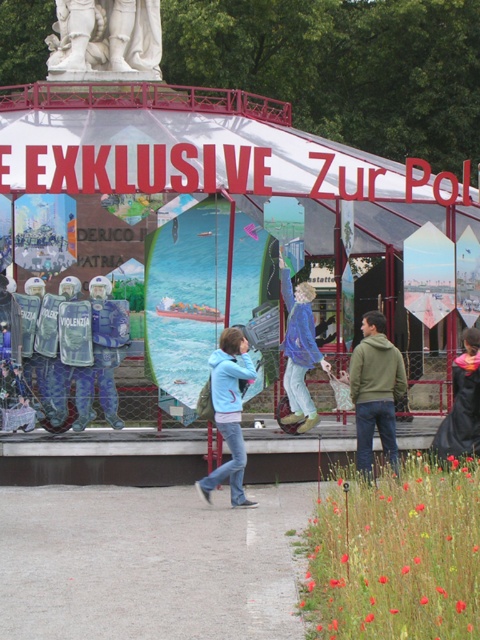
Who is higher up, light blue hoodie at center or blue denim jacket at center?

Positioned higher is blue denim jacket at center.

Who is lower down, light blue hoodie at center or blue denim jacket at center?

light blue hoodie at center

Locate an element on the screen. light blue hoodie at center is located at coordinates (228, 412).

Is blue reflective vest at center below black fabric coat at right?

No, blue reflective vest at center is not below black fabric coat at right.

At what (x,y) coordinates should I click in order to perform the action: click on blue reflective vest at center. Please return your answer as a coordinate pair (x, y). The image size is (480, 640). Looking at the image, I should click on (103, 355).

Does point (110, 344) come farther from viewer compared to point (462, 392)?

Yes.

You are a GUI agent. You are given a task and a screenshot of the screen. Output one action in this format:
    pyautogui.click(x=<x>, y=<y>)
    Task: Click on the blue reflective vest at center
    Image resolution: width=480 pixels, height=640 pixels.
    Given the screenshot: What is the action you would take?
    pyautogui.click(x=103, y=355)

This screenshot has width=480, height=640. I want to click on blue denim jacket at center, so click(x=299, y=349).

Does blue denim jacket at center appear over black fabric coat at right?

Yes, blue denim jacket at center is above black fabric coat at right.

Who is more forward, (309,362) or (462,412)?

Positioned in front is point (462,412).

At what (x,y) coordinates should I click in order to perform the action: click on blue denim jacket at center. Please return your answer as a coordinate pair (x, y). The image size is (480, 640). Looking at the image, I should click on (299, 349).